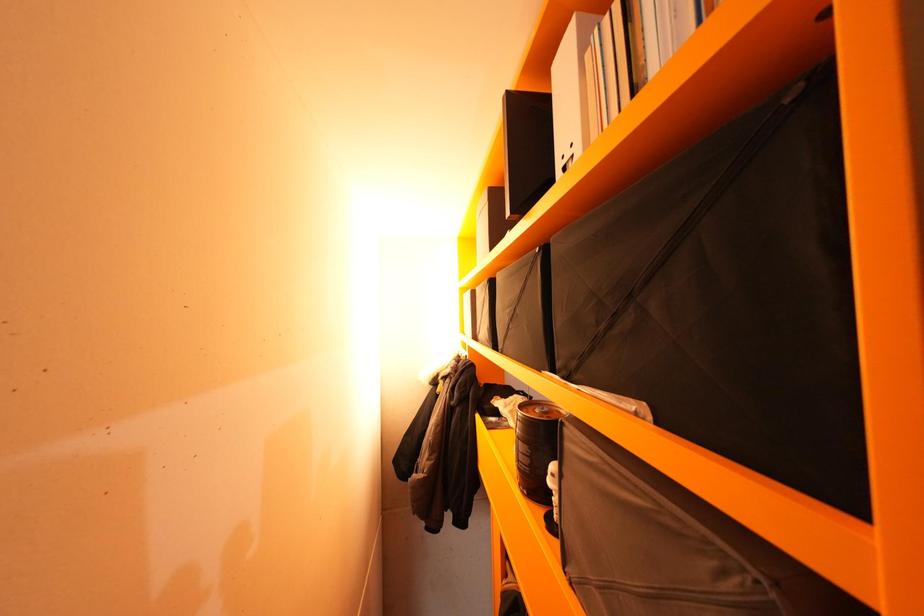
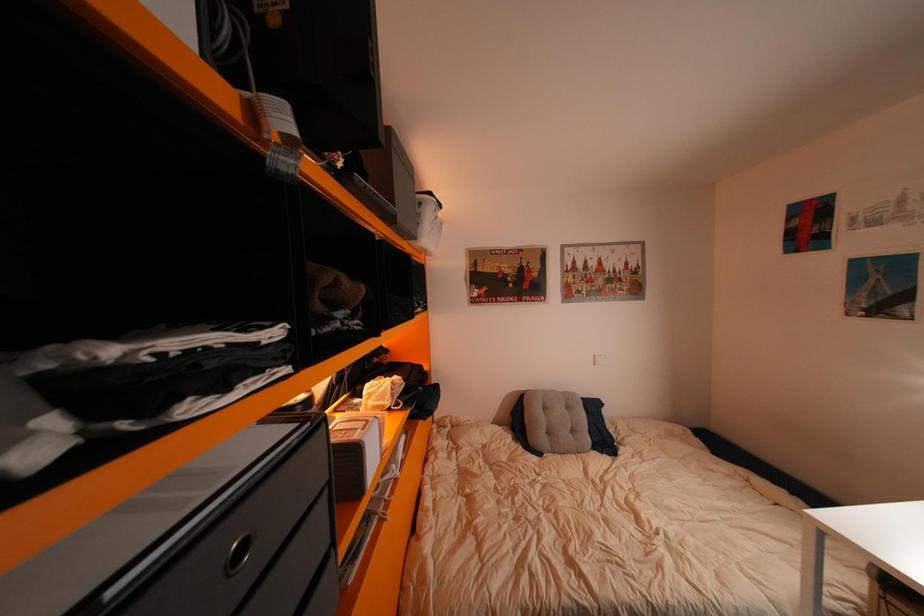
Question: The images are taken continuously from a first-person perspective. In which direction is your viewpoint rotating?

Choices:
 (A) Left
 (B) Right
 (C) Up
 (D) Down

Answer: (A)